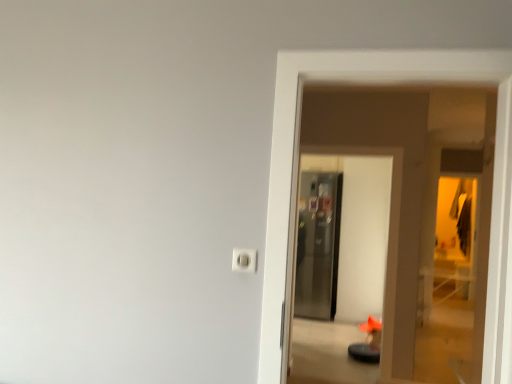
I want to click on vacant space behind satin metallic refrigerator at center, placed as the 1th screen door when sorted from front to back, so click(x=326, y=365).